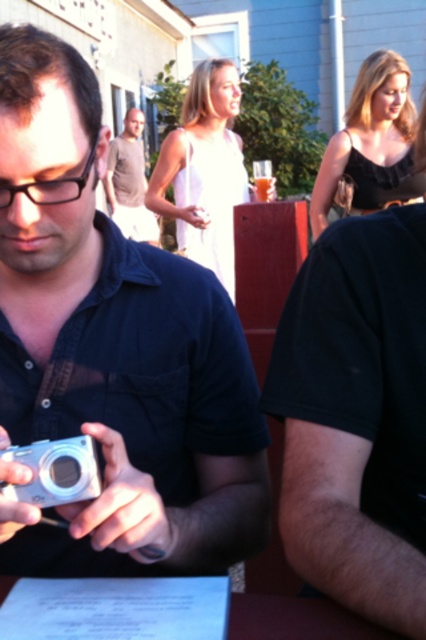
Who is shorter, silver metallic camera at lower left or light brown shirt at center?

silver metallic camera at lower left is shorter.

Which is in front, point (16, 458) or point (143, 221)?

Point (16, 458) is in front.

Between point (81, 440) and point (144, 236), which one is positioned in front?

Point (81, 440)

What are the coordinates of `silver metallic camera at lower left` in the screenshot? It's located at (55, 472).

Does point (155, 358) lie behind point (114, 157)?

That is False.

What do you see at coordinates (114, 352) in the screenshot? This screenshot has width=426, height=640. I see `silver metallic camera at left` at bounding box center [114, 352].

Image resolution: width=426 pixels, height=640 pixels. Find the location of `silver metallic camera at left`. silver metallic camera at left is located at coordinates (114, 352).

Is point (267, 625) positioned behind point (112, 214)?

No, it is in front of (112, 214).

Is white paper at lower center bigger than light brown shirt at center?

No, white paper at lower center is not bigger than light brown shirt at center.

Does point (325, 634) lie in front of point (123, 188)?

Yes, it is in front of point (123, 188).

Where is `white paper at lower center`? Image resolution: width=426 pixels, height=640 pixels. white paper at lower center is located at coordinates (298, 620).